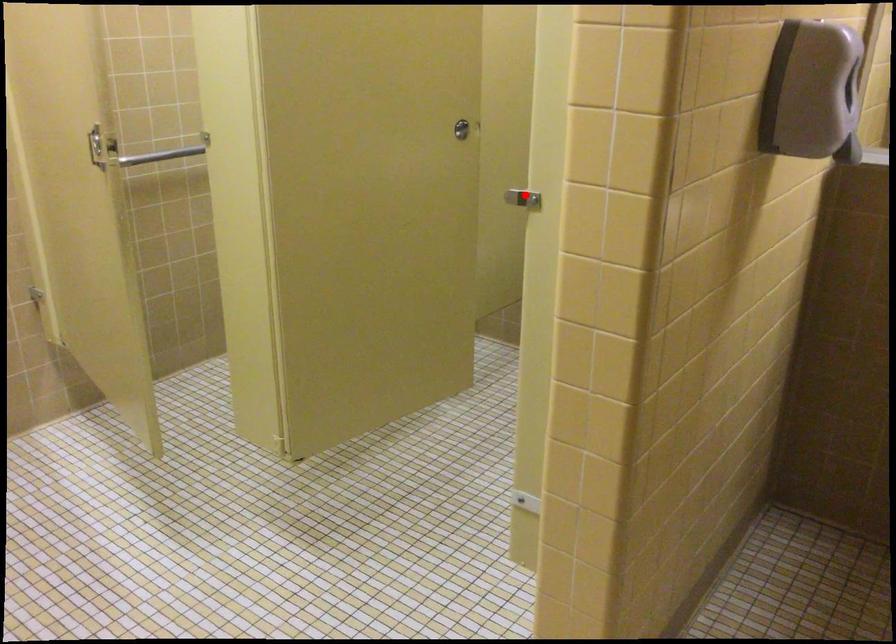
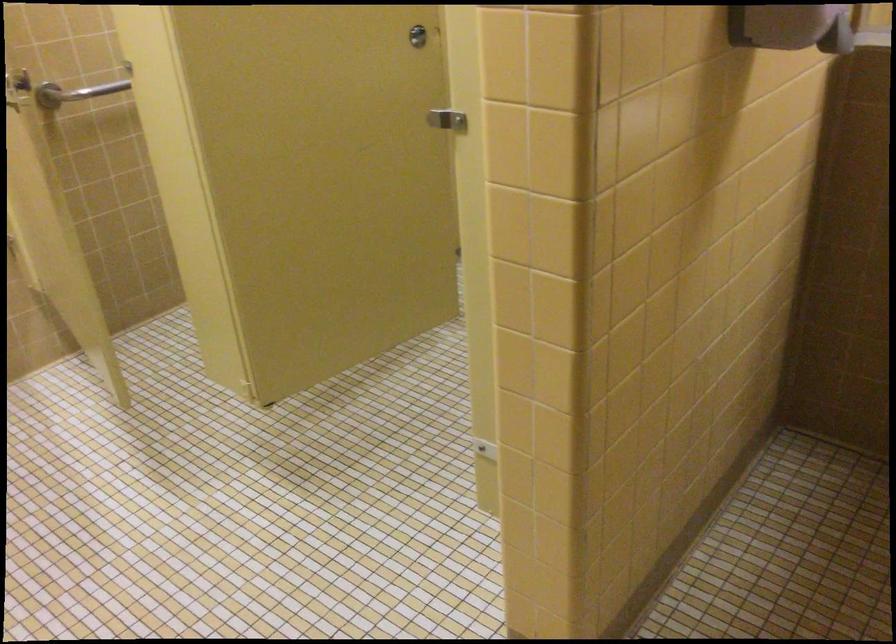
In the second image, find the point that corresponds to the highlighted location in the first image.

(446, 120)